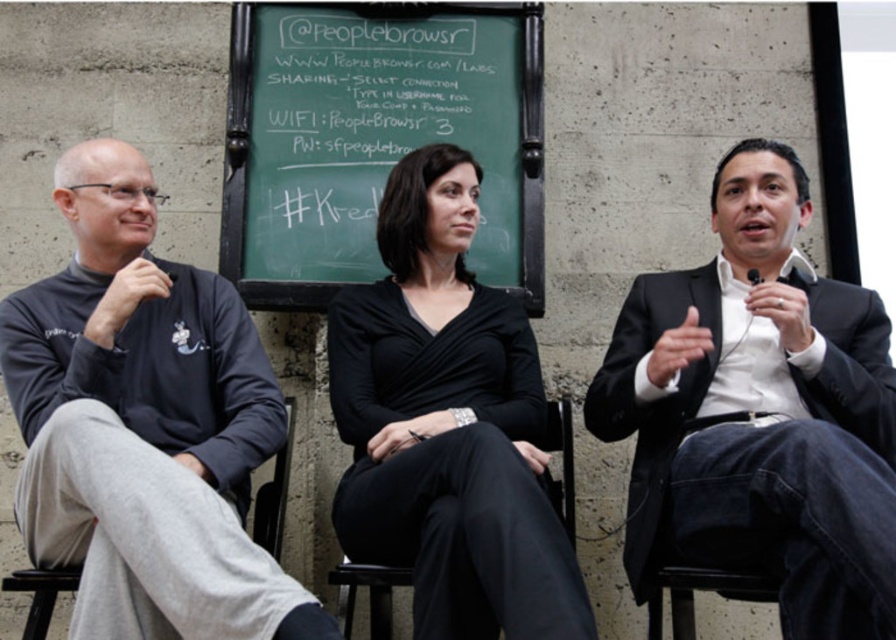
Is green chalkboard at center to the left of black matte microphone at right from the viewer's perspective?

Yes, green chalkboard at center is to the left of black matte microphone at right.

Does point (381, 116) come behind point (757, 273)?

Yes.

Find the location of `green chalkboard at center`. green chalkboard at center is located at coordinates (375, 138).

Who is shorter, dark gray sweatshirt at left or black leather chair at center?

With less height is black leather chair at center.

Is dark gray sweatshirt at left closer to camera compared to black leather chair at center?

Yes.

In order to click on dark gray sweatshirt at left in this screenshot , I will do `click(145, 413)`.

Which is behind, point (234, 524) or point (234, 128)?

Positioned behind is point (234, 128).

Can you confirm if dark gray sweatshirt at left is shorter than green chalkboard at center?

In fact, dark gray sweatshirt at left may be taller than green chalkboard at center.

Locate an element on the screen. This screenshot has width=896, height=640. dark gray sweatshirt at left is located at coordinates (145, 413).